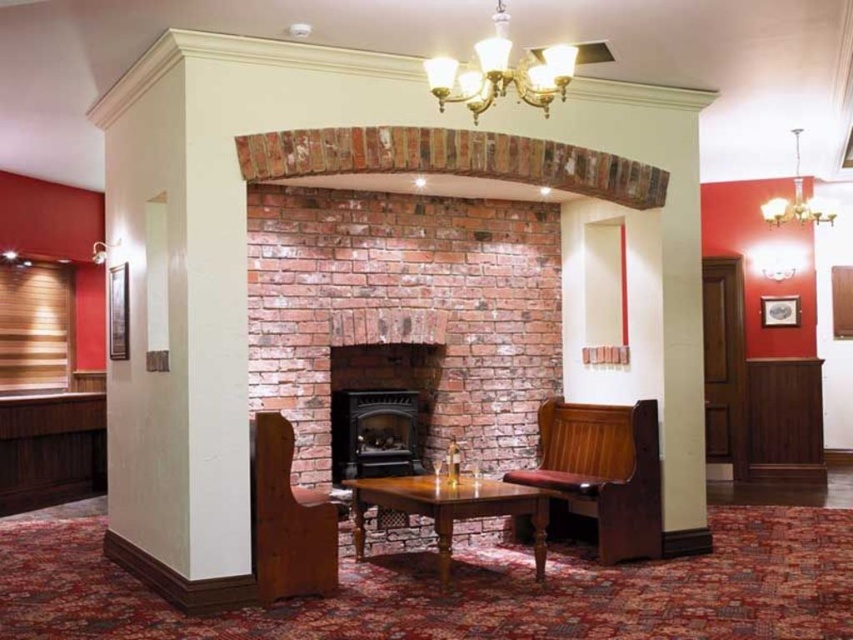
You are a guest in the lobby and want to sit comfortably while reading a book. The brown wood armchair at lower left and the wooden table at center are both available. Which one is more suitable for sitting?

The brown wood armchair at lower left is much taller than the wooden table at center, so it would be more suitable for sitting comfortably while reading a book since armchairs are typically designed for seating.

You are a guest in the lobby and want to sit down. You see the brown wood armchair at lower left and the wooden table at center. Which one is closer to you?

The brown wood armchair at lower left is positioned over the wooden table at center, meaning it is closer to you.